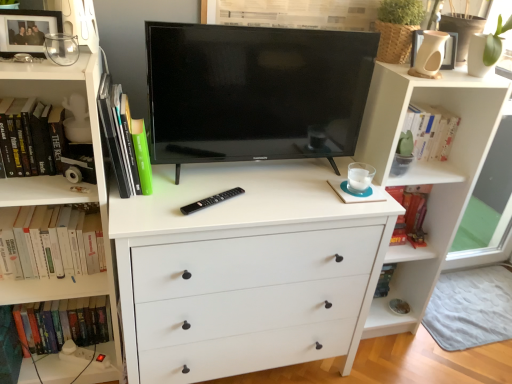
The image size is (512, 384). What are the coordinates of `empty space that is to the right of black plastic remote control at center` in the screenshot? It's located at (262, 206).